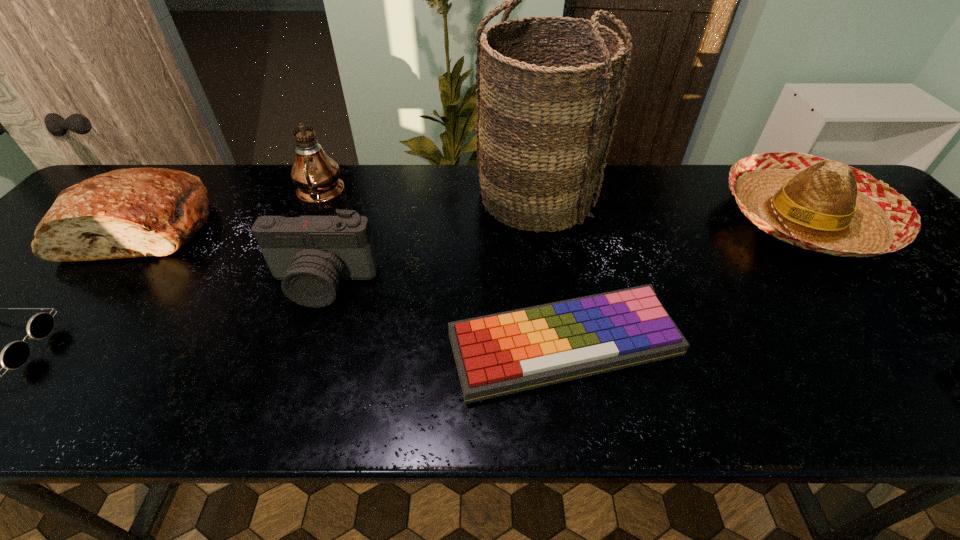
Identify the location of object that is at the far right corner. Image resolution: width=960 pixels, height=540 pixels. (818, 204).

Locate an element on the screen. The height and width of the screenshot is (540, 960). free space at the far edge of the desktop is located at coordinates (665, 199).

The height and width of the screenshot is (540, 960). I want to click on vacant space at the near edge of the desktop, so click(x=545, y=408).

At what (x,y) coordinates should I click in order to perform the action: click on vacant space at the left edge of the desktop. Please return your answer as a coordinate pair (x, y). This screenshot has width=960, height=540. Looking at the image, I should click on (71, 276).

The image size is (960, 540). Identify the location of blank region between the bread and the sombrero. (474, 222).

I want to click on free space between the sombrero and the bread, so click(x=474, y=222).

This screenshot has width=960, height=540. In order to click on blank region between the computer keyboard and the basket in this screenshot , I will do `click(550, 272)`.

Locate an element on the screen. The image size is (960, 540). free point between the sombrero and the computer keyboard is located at coordinates (684, 281).

Image resolution: width=960 pixels, height=540 pixels. Find the location of `vacant region between the basket and the camera`. vacant region between the basket and the camera is located at coordinates (429, 241).

At what (x,y) coordinates should I click in order to perform the action: click on the fourth closest object to the sombrero. Please return your answer as a coordinate pair (x, y). The image size is (960, 540). Looking at the image, I should click on pyautogui.click(x=310, y=254).